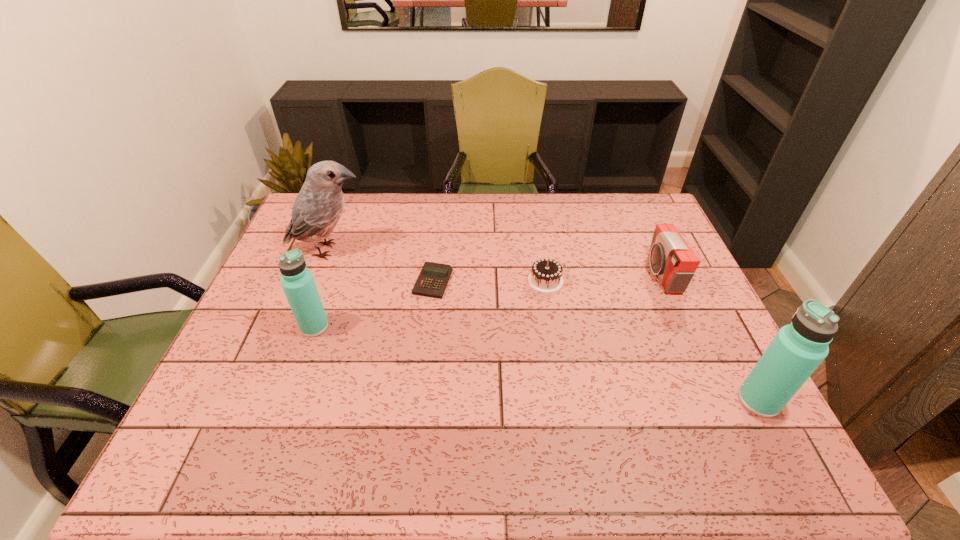
The width and height of the screenshot is (960, 540). Find the location of `parrot`. parrot is located at coordinates click(318, 207).

You are a GUI agent. You are given a task and a screenshot of the screen. Output one action in this format:
    pyautogui.click(x=<x>, y=<y>)
    Task: Click on the free space located 0.340m on the back of the farther thermos bottle
    Image resolution: width=960 pixels, height=540 pixels.
    Given the screenshot: What is the action you would take?
    pyautogui.click(x=346, y=239)

The height and width of the screenshot is (540, 960). What are the coordinates of `vacant space located on the back of the taller thermos bottle` in the screenshot? It's located at (695, 278).

Locate an element on the screen. The height and width of the screenshot is (540, 960). free location located 0.140m on the left of the chocolate cake is located at coordinates (481, 280).

You are a GUI agent. You are given a task and a screenshot of the screen. Output one action in this format:
    pyautogui.click(x=<x>, y=<y>)
    Task: Click on the blank space located 0.130m on the front-facing side of the fifth object from left to right
    This screenshot has width=960, height=540.
    Given the screenshot: What is the action you would take?
    pyautogui.click(x=606, y=274)

Locate an element on the screen. Image resolution: width=960 pixels, height=540 pixels. vacant space situated 0.050m on the front-facing side of the fifth object from left to right is located at coordinates (632, 274).

Locate an element on the screen. vacant area situated on the front-facing side of the fifth object from left to right is located at coordinates (609, 274).

Find the location of a particular element. This screenshot has width=960, height=540. free space located 0.190m on the left of the fourth object from right to left is located at coordinates (350, 281).

Identify the location of free space located on the front-facing side of the parrot. (412, 250).

Where is `object at the near edge`? object at the near edge is located at coordinates (796, 351).